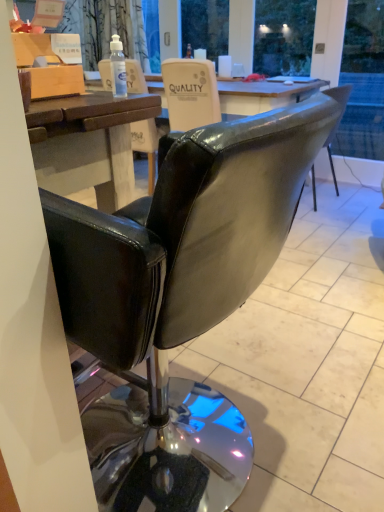
Question: Is wooden box at upper left facing towards transparent plastic bottle at upper center?

Choices:
 (A) no
 (B) yes

Answer: (A)

Question: From the image's perspective, would you say wooden box at upper left is shown under transparent plastic bottle at upper center?

Choices:
 (A) no
 (B) yes

Answer: (A)

Question: Considering the relative sizes of wooden box at upper left and transparent plastic bottle at upper center in the image provided, is wooden box at upper left smaller than transparent plastic bottle at upper center?

Choices:
 (A) yes
 (B) no

Answer: (B)

Question: Does wooden box at upper left have a greater height compared to transparent plastic bottle at upper center?

Choices:
 (A) no
 (B) yes

Answer: (B)

Question: From a real-world perspective, is wooden box at upper left physically below transparent plastic bottle at upper center?

Choices:
 (A) yes
 (B) no

Answer: (B)

Question: Is wooden box at upper left to the right of transparent plastic bottle at upper center from the viewer's perspective?

Choices:
 (A) no
 (B) yes

Answer: (A)

Question: Is transparent plastic bottle at upper center not within wooden box at upper left?

Choices:
 (A) yes
 (B) no

Answer: (A)

Question: From a real-world perspective, is transparent plastic bottle at upper center over wooden box at upper left?

Choices:
 (A) no
 (B) yes

Answer: (A)

Question: Is transparent plastic bottle at upper center behind wooden box at upper left?

Choices:
 (A) no
 (B) yes

Answer: (B)

Question: Considering the relative sizes of transparent plastic bottle at upper center and wooden box at upper left in the image provided, is transparent plastic bottle at upper center taller than wooden box at upper left?

Choices:
 (A) no
 (B) yes

Answer: (A)

Question: Is transparent plastic bottle at upper center beside wooden box at upper left?

Choices:
 (A) yes
 (B) no

Answer: (B)

Question: Considering the relative sizes of transparent plastic bottle at upper center and wooden box at upper left in the image provided, is transparent plastic bottle at upper center shorter than wooden box at upper left?

Choices:
 (A) no
 (B) yes

Answer: (B)

Question: Considering the relative sizes of transparent plastic bottle at upper center and black leather chair at center in the image provided, is transparent plastic bottle at upper center wider than black leather chair at center?

Choices:
 (A) yes
 (B) no

Answer: (B)